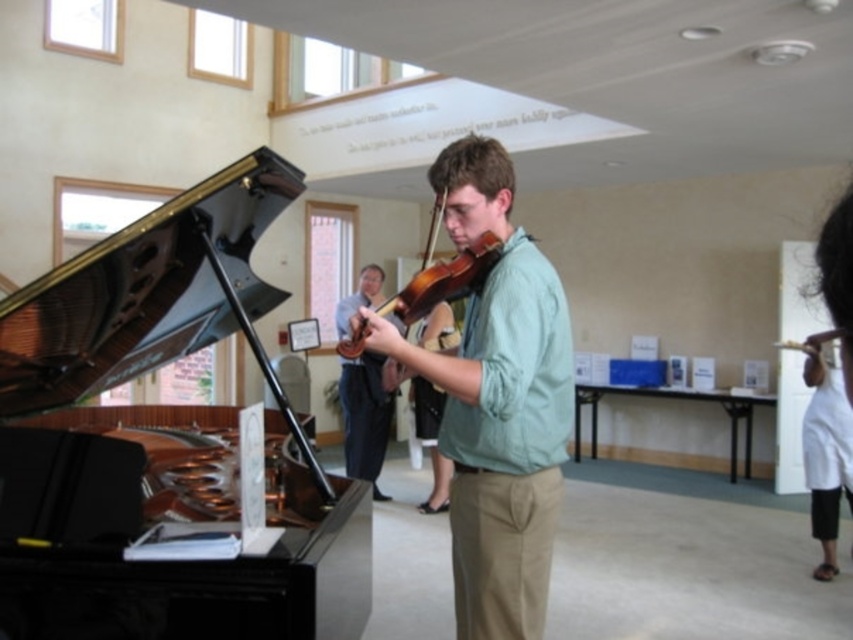
You are a photographer positioned in front of the scene. You want to take a photo that clearly shows both the matte green shirt at center and the wooden violin at center. Which object should you adjust your focus on to ensure both are in sharp focus?

The matte green shirt at center is further to the viewer than the wooden violin at center. To ensure both are in sharp focus, adjust your focus on the matte green shirt at center since it is closer, allowing the violin behind it to also be in focus within the depth of field.